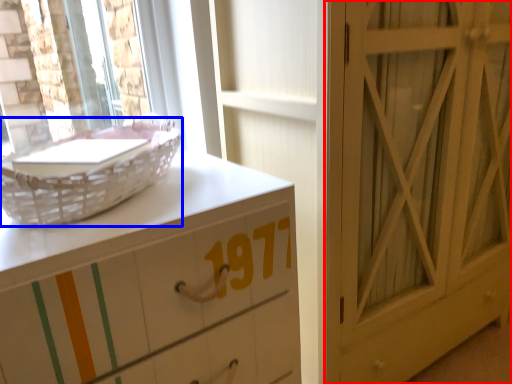
Question: Among these objects, which one is farthest to the camera, door (highlighted by a red box) or basket (highlighted by a blue box)?

Choices:
 (A) door
 (B) basket

Answer: (A)